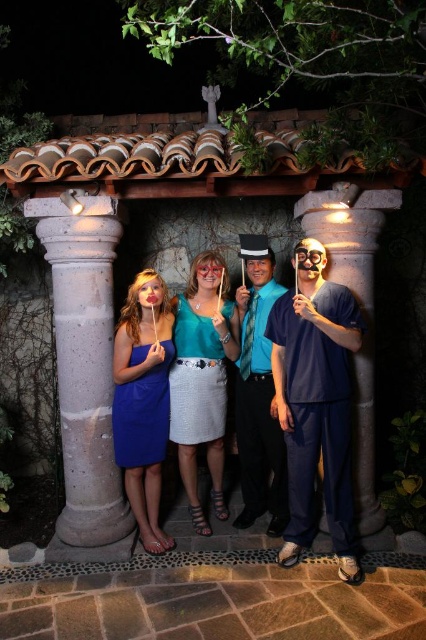
Which is more to the left, matte blue dress at left or matte teal dress at center?

Positioned to the left is matte blue dress at left.

Describe the element at coordinates (143, 406) in the screenshot. I see `matte blue dress at left` at that location.

Which is behind, point (124, 458) or point (215, 260)?

The point (215, 260) is behind.

Locate an element on the screen. matte blue dress at left is located at coordinates (143, 406).

Does point (112, 211) come farther from viewer compared to point (129, 408)?

Yes.

Which is below, speckled concrete column at left or matte blue dress at left?

matte blue dress at left

Is point (68, 196) positioned after point (155, 337)?

No, it is not.

You are a GUI agent. You are given a task and a screenshot of the screen. Output one action in this format:
    pyautogui.click(x=<x>, y=<y>)
    Task: Click on the speckled concrete column at left
    Image resolution: width=426 pixels, height=640 pixels.
    Given the screenshot: What is the action you would take?
    pyautogui.click(x=85, y=371)

Which is in front, point (354, 388) or point (259, 260)?

Point (354, 388)

Is point (359, 260) less distant than point (271, 275)?

Yes, it is in front of point (271, 275).

The image size is (426, 640). I want to click on matte stone pillar at center, so click(359, 305).

The height and width of the screenshot is (640, 426). Find the location of `matte stone pillar at center`. matte stone pillar at center is located at coordinates (359, 305).